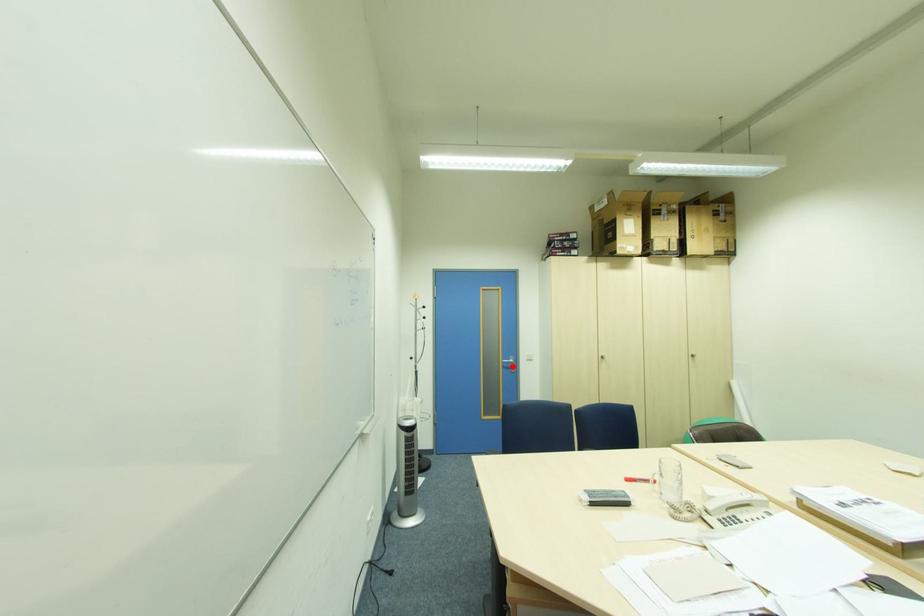
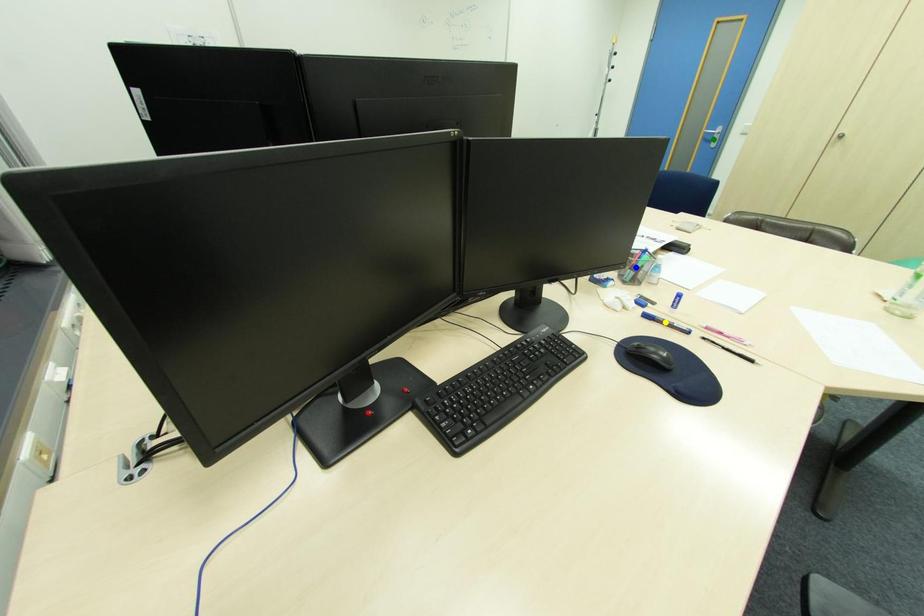
Question: I am providing you with two images of the same scene from different viewpoints. A red point is marked on the first image. You are given multiple points on the second image. Which mark in image 2 goes with the point in image 1?

Choices:
 (A) yellow point
 (B) green point
 (C) blue point

Answer: (B)